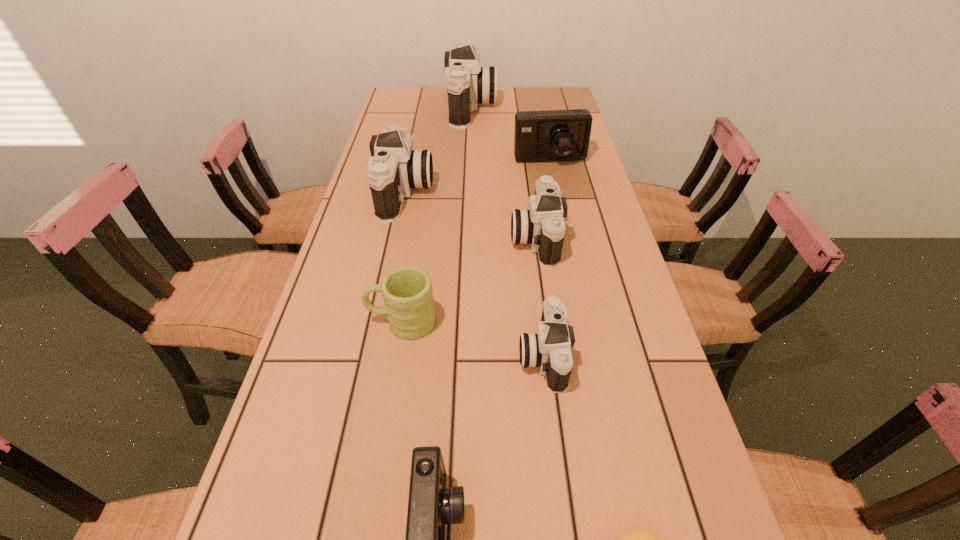
Identify the location of black camera that stands as the closest to the fifth farthest camera. The image size is (960, 540). (542, 226).

Locate which black camera is the third closest to the nearer blue camera. Please provide its 2D coordinates. Your answer should be formatted as a tuple, i.e. [(x, y)], where the tuple contains the x and y coordinates of a point satisfying the conditions above.

[(395, 169)]

I want to click on free space that satisfies the following two spatial constraints: 1. on the front-facing side of the farther blue camera; 2. on the side of the mug with the handle, so click(x=584, y=322).